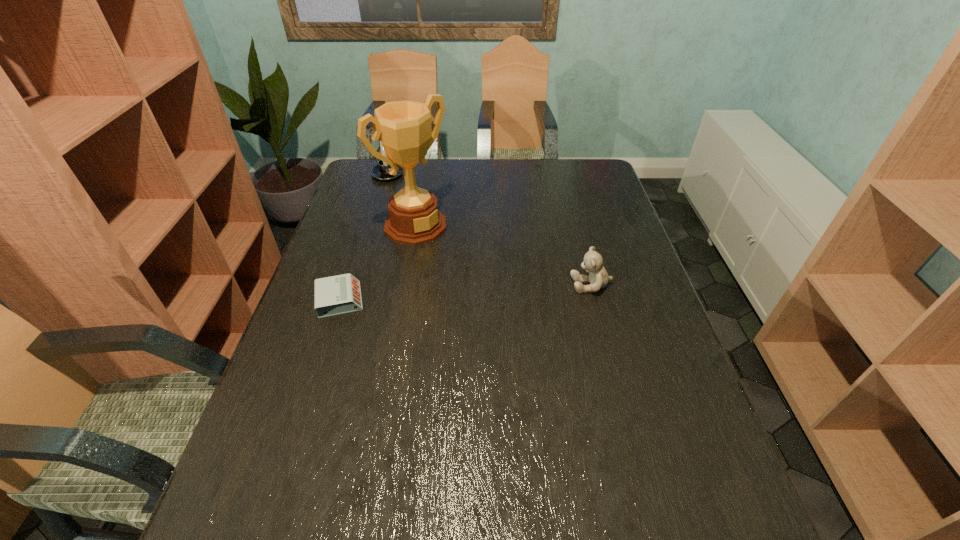
Image resolution: width=960 pixels, height=540 pixels. Find the location of `vacant space situated on the face of the second shortest object`. vacant space situated on the face of the second shortest object is located at coordinates (545, 285).

You are a GUI agent. You are given a task and a screenshot of the screen. Output one action in this format:
    pyautogui.click(x=<x>, y=<y>)
    Task: Click on the vacant space located with a handle on the side of the second tallest object
    
    Given the screenshot: What is the action you would take?
    pyautogui.click(x=428, y=229)

Where is `free spot located 0.170m with a handle on the side of the second tallest object`? The image size is (960, 540). free spot located 0.170m with a handle on the side of the second tallest object is located at coordinates (410, 205).

At what (x,y) coordinates should I click in order to perform the action: click on vacant space located with a handle on the side of the second tallest object. Please return your answer as a coordinate pair (x, y). The width and height of the screenshot is (960, 540). Looking at the image, I should click on (421, 220).

You are a GUI agent. You are given a task and a screenshot of the screen. Output one action in this format:
    pyautogui.click(x=<x>, y=<y>)
    Task: Click on the blank space located on the front-facing side of the third nearest object
    This screenshot has width=960, height=540.
    Given the screenshot: What is the action you would take?
    pyautogui.click(x=472, y=271)

The width and height of the screenshot is (960, 540). Identify the location of vacant point located on the front-facing side of the third nearest object. (468, 267).

This screenshot has width=960, height=540. In order to click on free space located on the front-facing side of the third nearest object in this screenshot , I will do `click(484, 280)`.

Where is `object located at the far edge`? This screenshot has height=540, width=960. object located at the far edge is located at coordinates (380, 172).

Where is `alarm clock at the left edge`? This screenshot has height=540, width=960. alarm clock at the left edge is located at coordinates (340, 294).

Identify the location of candle holder located in the left edge section of the desktop. Image resolution: width=960 pixels, height=540 pixels. (380, 172).